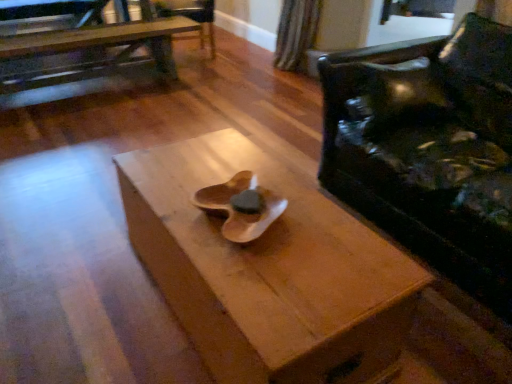
In order to face black leather couch at right, should I rotate leftwards or rightwards?

A 27.326 degree turn to the right will do.

Where is `wooden armchair at upper center`? wooden armchair at upper center is located at coordinates (192, 16).

This screenshot has height=384, width=512. What do you see at coordinates (90, 48) in the screenshot?
I see `wooden table at upper left, arranged as the first table when viewed from the top` at bounding box center [90, 48].

Image resolution: width=512 pixels, height=384 pixels. What are the coordinates of `wooden table at center, which ranks as the first table in front-to-back order` in the screenshot? It's located at (268, 271).

Could you tell me if black leather couch at right is turned towards wooden table at center, which is counted as the 2th table, starting from the top?

Yes, black leather couch at right faces towards wooden table at center, which is counted as the 2th table, starting from the top.

Is black leather couch at right wider than wooden table at center, which ranks as the first table in front-to-back order?

Indeed, black leather couch at right has a greater width compared to wooden table at center, which ranks as the first table in front-to-back order.

From the image's perspective, is black leather couch at right below wooden table at center, which ranks as the 1th table in bottom-to-top order?

Incorrect, from the image's perspective, black leather couch at right is higher than wooden table at center, which ranks as the 1th table in bottom-to-top order.

Who is smaller, black leather couch at right or wooden table at center, the 2th table in the back-to-front sequence?

Smaller between the two is wooden table at center, the 2th table in the back-to-front sequence.

From the image's perspective, would you say wooden armchair at upper center is positioned over wooden table at center, which ranks as the 1th table in bottom-to-top order?

Yes.

Looking at this image, is wooden armchair at upper center directly adjacent to wooden table at center, which ranks as the 1th table in bottom-to-top order?

wooden armchair at upper center and wooden table at center, which ranks as the 1th table in bottom-to-top order, are clearly separated.

From a real-world perspective, who is located higher, wooden armchair at upper center or wooden table at center, the 2th table in the back-to-front sequence?

Answer: wooden armchair at upper center.

Which object is further away from the camera, wooden table at upper left, placed as the first table when sorted from left to right, or black leather couch at right?

wooden table at upper left, placed as the first table when sorted from left to right, is further from the camera.

Is black leather couch at right at the back of wooden table at upper left, the second table ordered from the bottom?

Yes, black leather couch at right is at the back of wooden table at upper left, the second table ordered from the bottom.

Based on the photo, considering the relative sizes of wooden table at upper left, the 2th table viewed from the right, and black leather couch at right in the image provided, is wooden table at upper left, the 2th table viewed from the right, wider than black leather couch at right?

No.

From the image's perspective, which one is positioned higher, wooden table at upper left, arranged as the 1th table when viewed from the back, or black leather couch at right?

From the image's view, wooden table at upper left, arranged as the 1th table when viewed from the back, is above.

Are wooden table at upper left, arranged as the 1th table when viewed from the back, and wooden table at center, which is counted as the 2th table, starting from the top, located far from each other?

That's right, there is a large distance between wooden table at upper left, arranged as the 1th table when viewed from the back, and wooden table at center, which is counted as the 2th table, starting from the top.

Does wooden table at upper left, placed as the first table when sorted from left to right, have a larger size compared to wooden table at center, which ranks as the first table in front-to-back order?

Indeed, wooden table at upper left, placed as the first table when sorted from left to right, has a larger size compared to wooden table at center, which ranks as the first table in front-to-back order.

From a real-world perspective, which is physically below, wooden table at upper left, arranged as the 1th table when viewed from the back, or wooden table at center, which ranks as the first table in front-to-back order?

wooden table at center, which ranks as the first table in front-to-back order.

Is wooden table at upper left, arranged as the 1th table when viewed from the back, not within wooden table at center, which ranks as the first table in front-to-back order?

Absolutely, wooden table at upper left, arranged as the 1th table when viewed from the back, is external to wooden table at center, which ranks as the first table in front-to-back order.

Which of these two, wooden table at center, which ranks as the 1th table in bottom-to-top order, or wooden table at upper left, placed as the second table when sorted from front to back, is smaller?

wooden table at center, which ranks as the 1th table in bottom-to-top order.

Is wooden table at upper left, arranged as the 1th table when viewed from the back, a part of wooden table at center, the 2th table in the back-to-front sequence?

Definitely not — wooden table at upper left, arranged as the 1th table when viewed from the back, is not inside wooden table at center, the 2th table in the back-to-front sequence.

Considering the sizes of wooden table at center, which ranks as the 1th table in bottom-to-top order, and wooden table at upper left, the 2th table viewed from the right, in the image, is wooden table at center, which ranks as the 1th table in bottom-to-top order, taller or shorter than wooden table at upper left, the 2th table viewed from the right,?

wooden table at center, which ranks as the 1th table in bottom-to-top order, is shorter than wooden table at upper left, the 2th table viewed from the right.

Considering the positions of objects wooden table at center, which is counted as the 2th table, starting from the top, and wooden table at upper left, placed as the second table when sorted from front to back, in the image provided, who is more to the left, wooden table at center, which is counted as the 2th table, starting from the top, or wooden table at upper left, placed as the second table when sorted from front to back,?

wooden table at upper left, placed as the second table when sorted from front to back.

Is black leather couch at right directly adjacent to wooden table at upper left, arranged as the 1th table when viewed from the back?

No, black leather couch at right is not touching wooden table at upper left, arranged as the 1th table when viewed from the back.

Considering the relative positions of black leather couch at right and wooden table at upper left, arranged as the 1th table when viewed from the back, in the image provided, is black leather couch at right in front of wooden table at upper left, arranged as the 1th table when viewed from the back,?

Yes, black leather couch at right is closer to the viewer.

This screenshot has height=384, width=512. In order to click on chair that is below the wooden table at upper left, arranged as the 1th table when viewed from the back (from the image's perspective) in this screenshot , I will do `click(429, 149)`.

Which point is more forward, (354, 74) or (20, 55)?

Point (354, 74)

Is wooden table at center, which ranks as the 1th table in bottom-to-top order, positioned in front of wooden armchair at upper center?

That is True.

Is wooden armchair at upper center at the back of wooden table at center, which ranks as the 1th table in bottom-to-top order?

No, wooden table at center, which ranks as the 1th table in bottom-to-top order, is not facing the opposite direction of wooden armchair at upper center.

How far apart are wooden table at center, the 2th table in the back-to-front sequence, and wooden armchair at upper center?

3.15 meters.

What are the coordinates of `chair above the wooden table at center, which ranks as the 1th table in bottom-to-top order (from the image's perspective)` in the screenshot? It's located at (429, 149).

The image size is (512, 384). Find the location of `the 2nd table positioned below the wooden armchair at upper center (from the image's perspective)`. the 2nd table positioned below the wooden armchair at upper center (from the image's perspective) is located at coordinates (268, 271).

Looking at this image, which object lies further to the anchor point wooden table at upper left, the second table ordered from the bottom, wooden armchair at upper center or black leather couch at right?

black leather couch at right.

From the image, which object appears to be farther from wooden armchair at upper center, wooden table at center, which ranks as the 1th table in bottom-to-top order, or wooden table at upper left, arranged as the first table when viewed from the top?

wooden table at center, which ranks as the 1th table in bottom-to-top order.

Considering their positions, is wooden table at upper left, placed as the second table when sorted from front to back, positioned further to wooden armchair at upper center than wooden table at center, which ranks as the first table in front-to-back order?

wooden table at center, which ranks as the first table in front-to-back order, lies further to wooden armchair at upper center than the other object.

Looking at the image, which one is located closer to wooden table at center, which ranks as the 1th table in bottom-to-top order, wooden armchair at upper center or wooden table at upper left, placed as the second table when sorted from front to back?

The object closer to wooden table at center, which ranks as the 1th table in bottom-to-top order, is wooden table at upper left, placed as the second table when sorted from front to back.

In the scene shown: From the image, which object appears to be farther from black leather couch at right, wooden table at center, the 1th table viewed from the right, or wooden armchair at upper center?

Among the two, wooden armchair at upper center is located further to black leather couch at right.

Estimate the real-world distances between objects in this image. Which object is further from wooden table at upper left, placed as the first table when sorted from left to right, black leather couch at right or wooden armchair at upper center?

black leather couch at right is positioned further to the anchor wooden table at upper left, placed as the first table when sorted from left to right.

Which object lies further to the anchor point wooden table at upper left, placed as the second table when sorted from front to back, wooden armchair at upper center or wooden table at center, which ranks as the 1th table in bottom-to-top order?

wooden table at center, which ranks as the 1th table in bottom-to-top order, is further to wooden table at upper left, placed as the second table when sorted from front to back.

Which object lies nearer to the anchor point black leather couch at right, wooden armchair at upper center or wooden table at center, which ranks as the first table in front-to-back order?

wooden table at center, which ranks as the first table in front-to-back order.

Locate an element on the screen. Image resolution: width=512 pixels, height=384 pixels. chair positioned between wooden table at center, which ranks as the first table in front-to-back order, and wooden armchair at upper center from near to far is located at coordinates (429, 149).

The height and width of the screenshot is (384, 512). What are the coordinates of `table between black leather couch at right and wooden armchair at upper center from front to back` in the screenshot? It's located at coord(90,48).

At what (x,y) coordinates should I click in order to perform the action: click on table between wooden table at center, the 2th table in the back-to-front sequence, and wooden armchair at upper center from front to back. Please return your answer as a coordinate pair (x, y). Looking at the image, I should click on (90, 48).

At what (x,y) coordinates should I click in order to perform the action: click on table between wooden table at upper left, the second table ordered from the bottom, and black leather couch at right. Please return your answer as a coordinate pair (x, y). This screenshot has width=512, height=384. Looking at the image, I should click on click(268, 271).